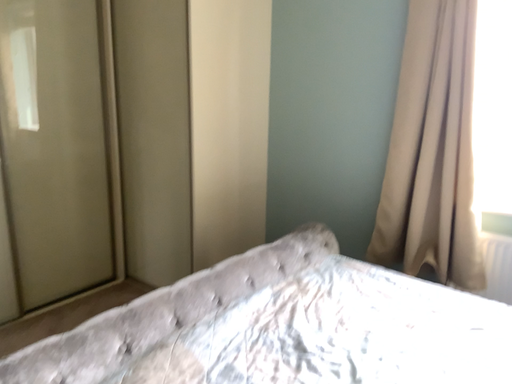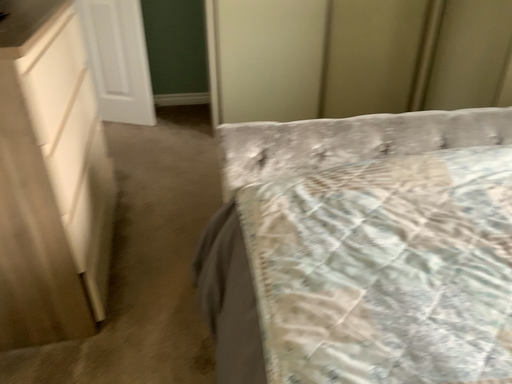
Question: How did the camera likely rotate when shooting the video?

Choices:
 (A) rotated upward
 (B) rotated downward

Answer: (B)